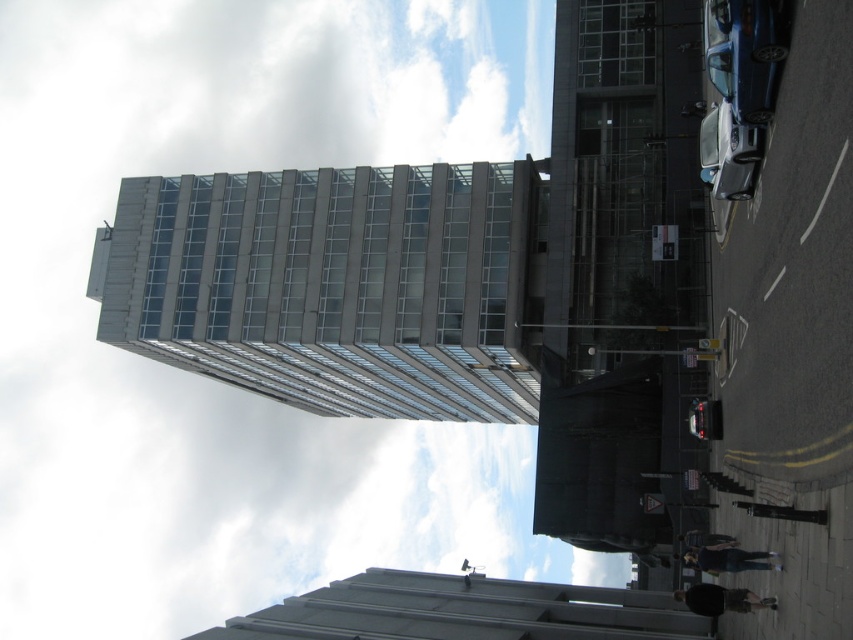
You are an urban planner assessing the space between two glassy structures in the city. The glassy concrete tower at center and the glassy concrete building at center are both part of your project. Since you need to install a new bench between them, can you confirm if the space between them is wide enough for a bench that is 2 meters in length?

The glassy concrete tower at center is wider than the glassy concrete building at center, but the description does not provide specific measurements of the distance between them. Therefore, it is unclear if the space between them is sufficient for a 2 meter bench.

You are standing at the point marked as point [207,380] in the urban scene. What object is located exactly at that point?

The white glass building at upper center is located exactly at point [207,380].

You are standing at the intersection near the glassy concrete tower at center. A friend is waiting at the coordinates point 0.5, 0.4. Are you and your friend at the same location?

The glassy concrete tower at center is located at point (334, 285). Your friend is at (340, 320). These coordinates are close but not exactly the same, so you are not at the same location.